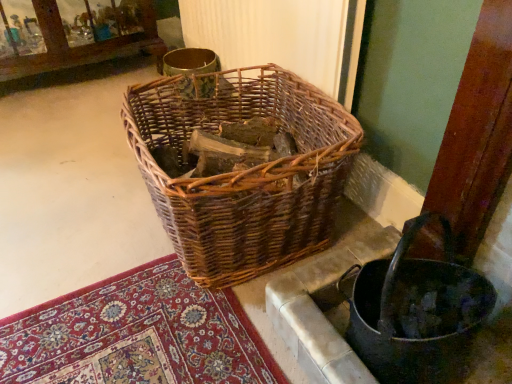
Question: Looking at their shapes, would you say woven wood basket at lower right is wider or thinner than woven brown basket at center?

Choices:
 (A) thin
 (B) wide

Answer: (A)

Question: From the image's perspective, is woven wood basket at lower right above or below woven brown basket at center?

Choices:
 (A) above
 (B) below

Answer: (B)

Question: Based on their positions, is woven wood basket at lower right located to the left or right of woven brown basket at center?

Choices:
 (A) left
 (B) right

Answer: (B)

Question: Is woven brown basket at center spatially inside woven wood basket at lower right, or outside of it?

Choices:
 (A) outside
 (B) inside

Answer: (A)

Question: From a real-world perspective, is woven brown basket at center positioned above or below woven wood basket at lower right?

Choices:
 (A) below
 (B) above

Answer: (B)

Question: In the image, is woven brown basket at center positioned in front of or behind woven wood basket at lower right?

Choices:
 (A) front
 (B) behind

Answer: (B)

Question: Based on their positions, is woven brown basket at center located to the left or right of woven wood basket at lower right?

Choices:
 (A) left
 (B) right

Answer: (A)